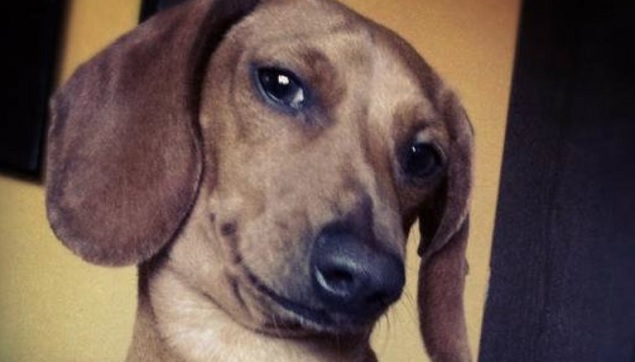
Where is `wall art`? wall art is located at coordinates (27, 66).